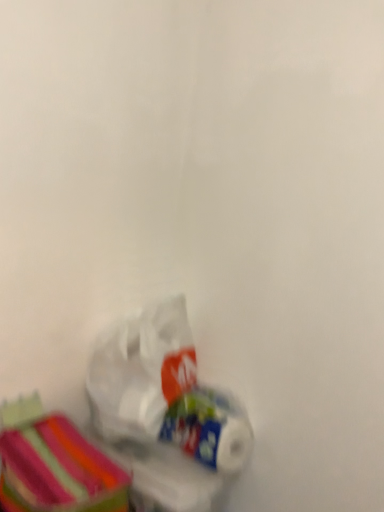
In order to face striped fabric storage box at lower left, should I rotate leftwards or rightwards?

It's best to rotate left around 15.887 degrees.

This screenshot has width=384, height=512. What do you see at coordinates (209, 429) in the screenshot? I see `white glossy toilet paper at lower center` at bounding box center [209, 429].

The width and height of the screenshot is (384, 512). Find the location of `striped fabric storage box at lower left`. striped fabric storage box at lower left is located at coordinates (58, 470).

Is white glossy toilet paper at lower center wider than striped fabric storage box at lower left?

In fact, white glossy toilet paper at lower center might be narrower than striped fabric storage box at lower left.

From the image's perspective, which one is positioned lower, white glossy toilet paper at lower center or striped fabric storage box at lower left?

striped fabric storage box at lower left, from the image's perspective.

Relative to striped fabric storage box at lower left, is white glossy toilet paper at lower center in front or behind?

white glossy toilet paper at lower center is behind striped fabric storage box at lower left.

Can you confirm if white glossy toilet paper at lower center is bigger than striped fabric storage box at lower left?

Incorrect, white glossy toilet paper at lower center is not larger than striped fabric storage box at lower left.

Can you confirm if striped fabric storage box at lower left is wider than translucent plastic bag at lower left?

Indeed, striped fabric storage box at lower left has a greater width compared to translucent plastic bag at lower left.

In the scene shown: From a real-world perspective, is striped fabric storage box at lower left physically below translucent plastic bag at lower left?

Indeed, from a real-world perspective, striped fabric storage box at lower left is positioned beneath translucent plastic bag at lower left.

Considering the points (87, 485) and (144, 434), which point is behind, point (87, 485) or point (144, 434)?

The point (144, 434) is farther.

Considering the relative positions of striped fabric storage box at lower left and translucent plastic bag at lower left in the image provided, is striped fabric storage box at lower left to the left or to the right of translucent plastic bag at lower left?

Based on their positions, striped fabric storage box at lower left is located to the left of translucent plastic bag at lower left.

In the scene shown: Which of these two, white glossy toilet paper at lower center or translucent plastic bag at lower left, stands shorter?

With less height is white glossy toilet paper at lower center.

From a real-world perspective, is white glossy toilet paper at lower center positioned over translucent plastic bag at lower left based on gravity?

No, from a real-world perspective, white glossy toilet paper at lower center is not over translucent plastic bag at lower left

Between white glossy toilet paper at lower center and translucent plastic bag at lower left, which one has smaller width?

white glossy toilet paper at lower center.

Which is farther from the camera, [222,420] or [111,351]?

Point [111,351]

Is translucent plastic bag at lower left with striped fabric storage box at lower left?

No, translucent plastic bag at lower left is not with striped fabric storage box at lower left.

Is point (120, 413) more distant than point (39, 490)?

Yes, point (120, 413) is farther from viewer.

Is translucent plastic bag at lower left positioned behind striped fabric storage box at lower left?

Yes, translucent plastic bag at lower left is further from the camera.

From the image's perspective, is translucent plastic bag at lower left located above or below striped fabric storage box at lower left?

From the image's perspective, translucent plastic bag at lower left appears above striped fabric storage box at lower left.

Which object is closer to the camera taking this photo, striped fabric storage box at lower left or white glossy toilet paper at lower center?

striped fabric storage box at lower left is more forward.

Is striped fabric storage box at lower left not close to white glossy toilet paper at lower center?

Actually, striped fabric storage box at lower left and white glossy toilet paper at lower center are a little close together.

Is point (39, 488) closer to camera compared to point (236, 404)?

Yes, point (39, 488) is in front of point (236, 404).

Is striped fabric storage box at lower left wider or thinner than white glossy toilet paper at lower center?

Considering their sizes, striped fabric storage box at lower left looks broader than white glossy toilet paper at lower center.

Is translucent plastic bag at lower left turned away from white glossy toilet paper at lower center?

No, translucent plastic bag at lower left is not facing the opposite direction of white glossy toilet paper at lower center.

Can you confirm if translucent plastic bag at lower left is positioned to the left of white glossy toilet paper at lower center?

Indeed, translucent plastic bag at lower left is positioned on the left side of white glossy toilet paper at lower center.

Does translucent plastic bag at lower left have a smaller size compared to white glossy toilet paper at lower center?

No.

I want to click on toilet paper that is behind the translucent plastic bag at lower left, so click(209, 429).

Where is `toilet paper that appears behind the striped fabric storage box at lower left`? The image size is (384, 512). toilet paper that appears behind the striped fabric storage box at lower left is located at coordinates (209, 429).

I want to click on storage box that is on the left side of translucent plastic bag at lower left, so click(x=58, y=470).

Which object lies further to the anchor point translucent plastic bag at lower left, striped fabric storage box at lower left or white glossy toilet paper at lower center?

Based on the image, striped fabric storage box at lower left appears to be further to translucent plastic bag at lower left.

When comparing their distances from white glossy toilet paper at lower center, does translucent plastic bag at lower left or striped fabric storage box at lower left seem closer?

translucent plastic bag at lower left is closer to white glossy toilet paper at lower center.

Which object lies further to the anchor point white glossy toilet paper at lower center, striped fabric storage box at lower left or translucent plastic bag at lower left?

striped fabric storage box at lower left is further to white glossy toilet paper at lower center.

Considering their positions, is translucent plastic bag at lower left positioned further to striped fabric storage box at lower left than white glossy toilet paper at lower center?

white glossy toilet paper at lower center is further to striped fabric storage box at lower left.

Which object lies further to the anchor point striped fabric storage box at lower left, white glossy toilet paper at lower center or translucent plastic bag at lower left?

Based on the image, white glossy toilet paper at lower center appears to be further to striped fabric storage box at lower left.

Which object lies nearer to the anchor point translucent plastic bag at lower left, white glossy toilet paper at lower center or striped fabric storage box at lower left?

white glossy toilet paper at lower center.

Locate an element on the screen. plastic bag situated between striped fabric storage box at lower left and white glossy toilet paper at lower center from left to right is located at coordinates (163, 390).